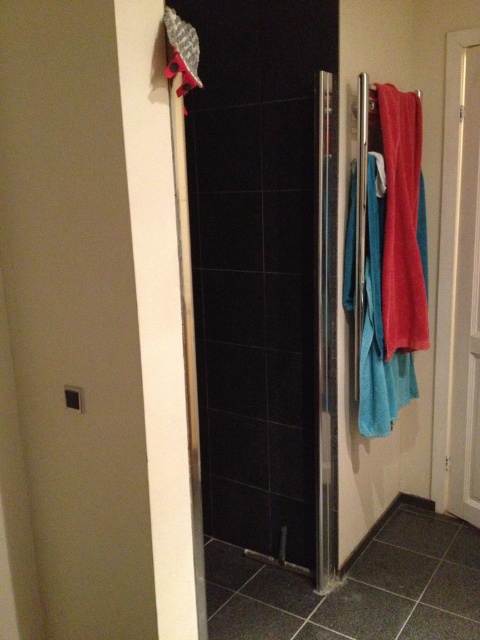
Question: Is white glossy door at right to the right of matte red towel at right from the viewer's perspective?

Choices:
 (A) yes
 (B) no

Answer: (A)

Question: Is white glossy door at right positioned in front of matte red towel at right?

Choices:
 (A) no
 (B) yes

Answer: (A)

Question: Is white glossy door at right thinner than matte red towel at right?

Choices:
 (A) no
 (B) yes

Answer: (B)

Question: Which point is closer to the camera taking this photo?

Choices:
 (A) (405, 328)
 (B) (436, 506)

Answer: (A)